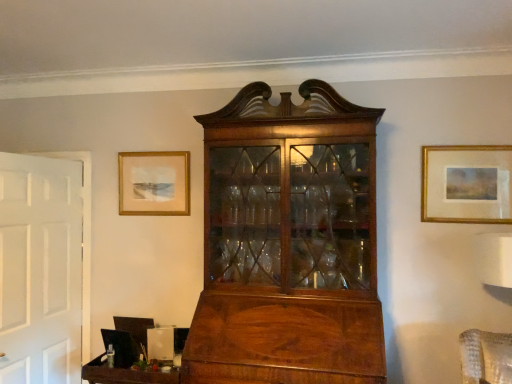
Question: Does gold-framed painting at upper right, the second picture frame viewed from the left, have a lesser height compared to matte gold picture frame at upper left, which ranks as the second picture frame in right-to-left order?

Choices:
 (A) yes
 (B) no

Answer: (B)

Question: Does gold-framed painting at upper right, which ranks as the 2th picture frame in back-to-front order, have a greater height compared to matte gold picture frame at upper left, which ranks as the second picture frame in right-to-left order?

Choices:
 (A) no
 (B) yes

Answer: (B)

Question: Can you confirm if gold-framed painting at upper right, the second picture frame viewed from the left, is wider than matte gold picture frame at upper left, which ranks as the second picture frame in right-to-left order?

Choices:
 (A) yes
 (B) no

Answer: (A)

Question: Can you see gold-framed painting at upper right, which is counted as the first picture frame, starting from the front, touching matte gold picture frame at upper left, which ranks as the second picture frame in right-to-left order?

Choices:
 (A) yes
 (B) no

Answer: (B)

Question: Is gold-framed painting at upper right, which is counted as the first picture frame, starting from the front, not inside matte gold picture frame at upper left, which ranks as the second picture frame in right-to-left order?

Choices:
 (A) no
 (B) yes

Answer: (B)

Question: Does point (116, 382) appear closer or farther from the camera than point (474, 163)?

Choices:
 (A) closer
 (B) farther

Answer: (A)

Question: Considering the positions of wooden tray at lower left and gold-framed painting at upper right, which is counted as the first picture frame, starting from the front, in the image, is wooden tray at lower left wider or thinner than gold-framed painting at upper right, which is counted as the first picture frame, starting from the front,?

Choices:
 (A) wide
 (B) thin

Answer: (A)

Question: Is wooden tray at lower left bigger or smaller than gold-framed painting at upper right, acting as the 1th picture frame starting from the right?

Choices:
 (A) small
 (B) big

Answer: (B)

Question: Visually, is wooden tray at lower left positioned to the left or to the right of gold-framed painting at upper right, the second picture frame viewed from the left?

Choices:
 (A) right
 (B) left

Answer: (B)

Question: Looking at the image, does gold-framed painting at upper right, the second picture frame viewed from the left, seem bigger or smaller compared to wooden tray at lower left?

Choices:
 (A) small
 (B) big

Answer: (A)

Question: Relative to wooden tray at lower left, is gold-framed painting at upper right, which ranks as the 2th picture frame in back-to-front order, in front or behind?

Choices:
 (A) behind
 (B) front

Answer: (A)

Question: From a real-world perspective, is gold-framed painting at upper right, which ranks as the 2th picture frame in back-to-front order, positioned above or below wooden tray at lower left?

Choices:
 (A) below
 (B) above

Answer: (B)

Question: In terms of width, does gold-framed painting at upper right, acting as the 1th picture frame starting from the right, look wider or thinner when compared to wooden tray at lower left?

Choices:
 (A) thin
 (B) wide

Answer: (A)

Question: Is gold-framed painting at upper right, which ranks as the 2th picture frame in back-to-front order, in front of or behind matte gold picture frame at upper left, which ranks as the second picture frame in right-to-left order, in the image?

Choices:
 (A) behind
 (B) front

Answer: (B)

Question: Does point (475, 150) appear closer or farther from the camera than point (125, 177)?

Choices:
 (A) farther
 (B) closer

Answer: (B)